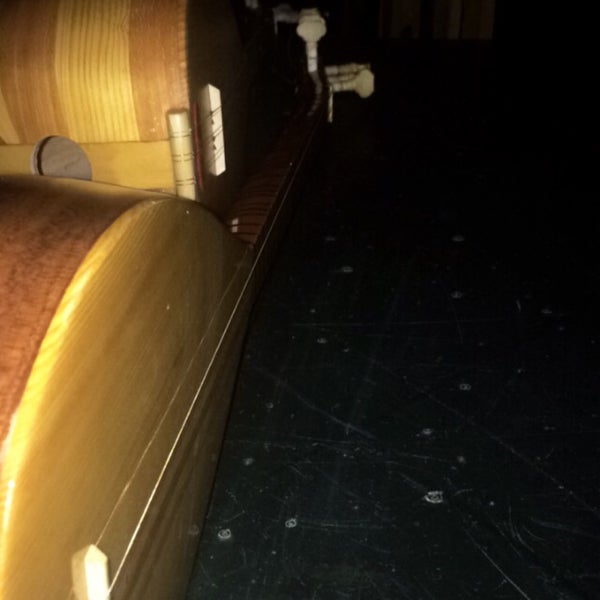
Where is `vinyl floor`? vinyl floor is located at coordinates (447, 353).